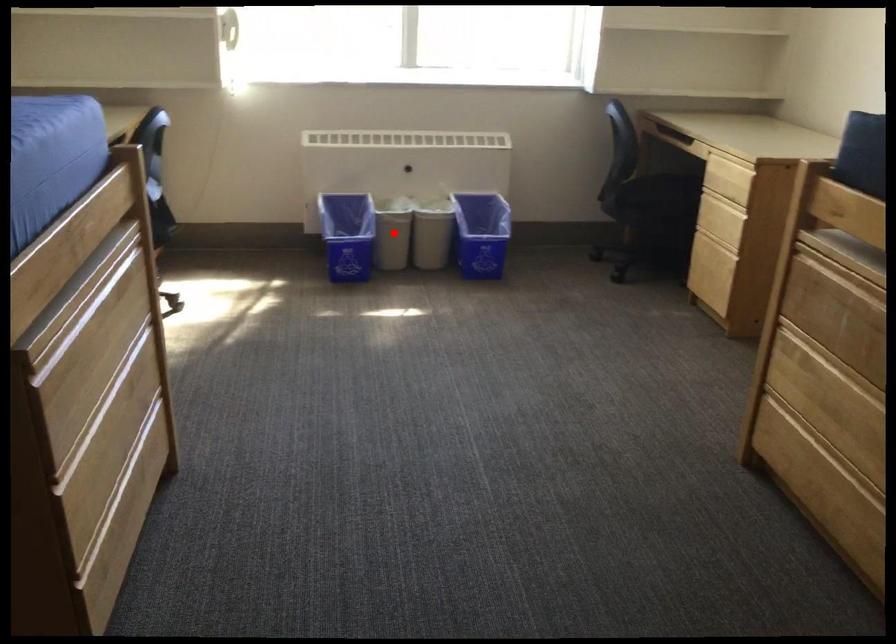
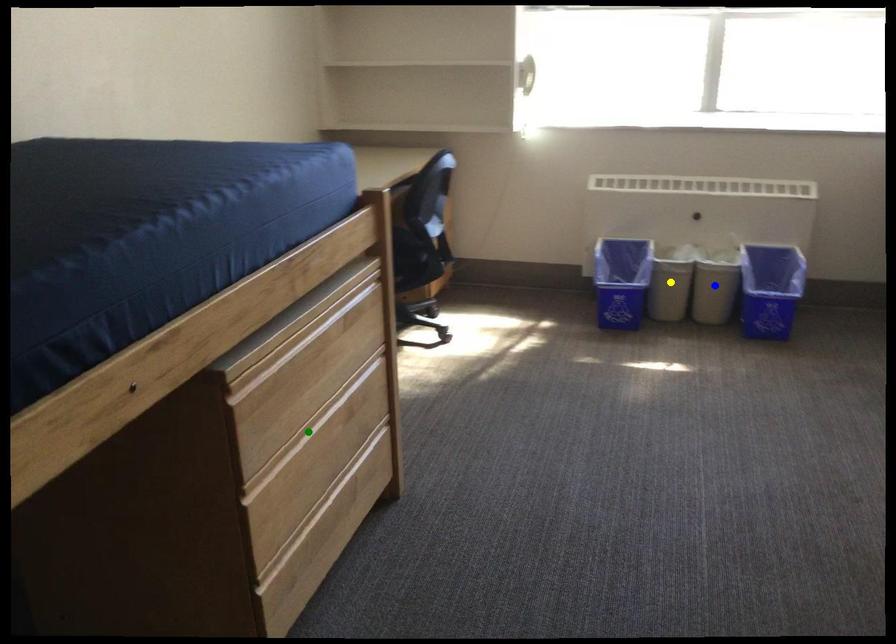
Question: I am providing you with two images of the same scene from different viewpoints. A red point is marked on the first image. You are given multiple points on the second image. Which spot in image 2 lines up with the point in image 1?

Choices:
 (A) blue point
 (B) green point
 (C) yellow point

Answer: (C)